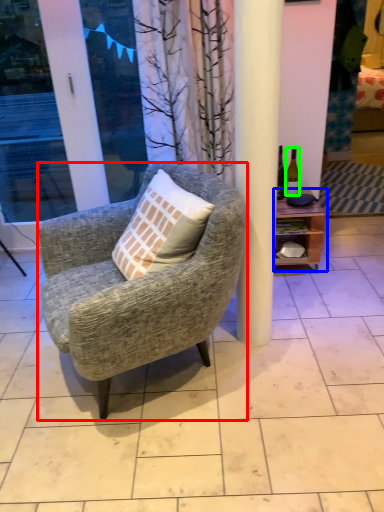
Question: Which is farther away from chair (highlighted by a red box)? shelf (highlighted by a blue box) or bottle (highlighted by a green box)?

Choices:
 (A) shelf
 (B) bottle

Answer: (B)